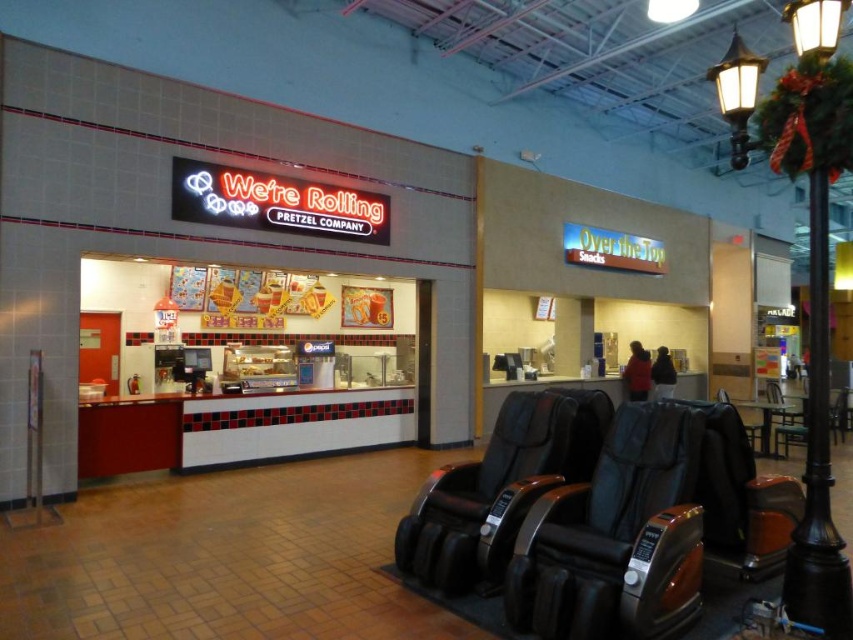
Is black leather swivel chair at lower right positioned at the back of black leather massage chair at center?

No, black leather swivel chair at lower right is closer to the viewer.

Is black leather swivel chair at lower right thinner than black leather massage chair at center?

Yes.

Locate an element on the screen. The width and height of the screenshot is (853, 640). black leather swivel chair at lower right is located at coordinates (616, 538).

Is matte red counter at center thinner than black leather massage chair at center?

Yes.

Who is more forward, (97,269) or (730,401)?

Point (97,269) is more forward.

Is point (152, 390) more distant than point (729, 401)?

No, (152, 390) is closer to viewer.

I want to click on matte red counter at center, so click(264, 396).

Is point (294, 438) closer to camera compared to point (550, 611)?

No, it is not.

Where is `matte red counter at center`? matte red counter at center is located at coordinates (264, 396).